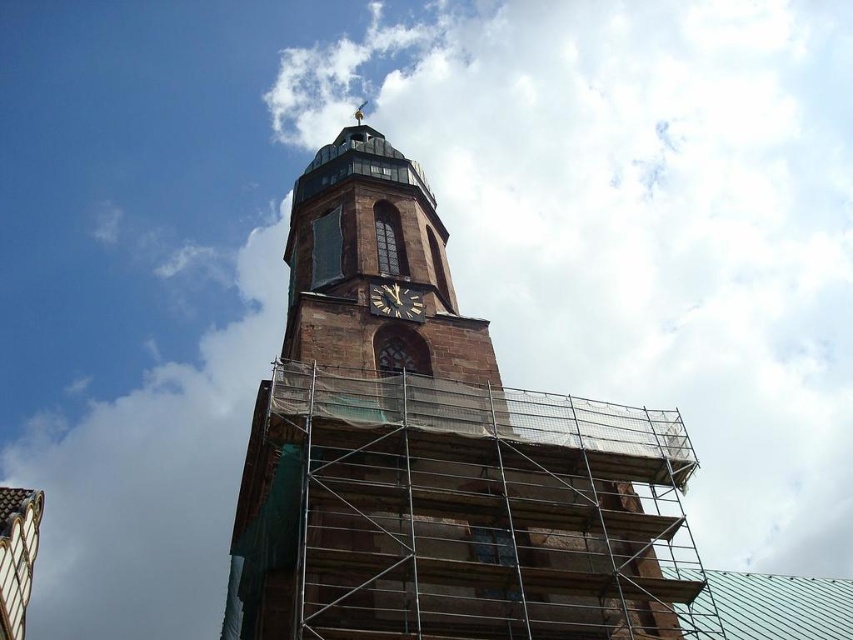
Between point (563, 536) and point (350, 346), which one is positioned behind?

The point (350, 346) is behind.

Between brown stone church at center and brown stone clock tower at center, which one appears on the right side from the viewer's perspective?

brown stone church at center is more to the right.

Between point (381, 544) and point (312, 337), which one is positioned in front?

Positioned in front is point (381, 544).

The image size is (853, 640). In order to click on brown stone church at center in this screenshot , I will do `click(437, 456)`.

Looking at this image, which of these two, brown stone clock tower at center or black polished wood clock at center, stands taller?

Standing taller between the two is brown stone clock tower at center.

This screenshot has height=640, width=853. What are the coordinates of `brown stone clock tower at center` in the screenshot? It's located at (376, 273).

Identify the location of brown stone clock tower at center. (376, 273).

Is brown stone church at center further to camera compared to black polished wood clock at center?

No, brown stone church at center is in front of black polished wood clock at center.

Which is more to the right, brown stone church at center or black polished wood clock at center?

black polished wood clock at center is more to the right.

Does point (460, 522) come behind point (370, 289)?

No, (460, 522) is in front of (370, 289).

Where is `brown stone church at center`? This screenshot has width=853, height=640. brown stone church at center is located at coordinates (437, 456).